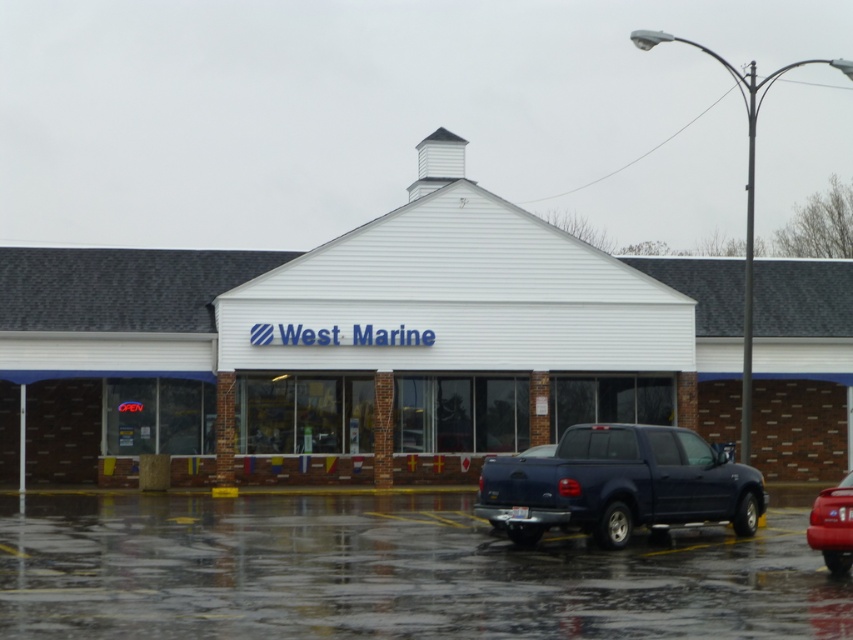
Measure the distance from wet asphalt at lower center to dark blue matte truck at lower center.

wet asphalt at lower center is 4.54 meters from dark blue matte truck at lower center.

This screenshot has height=640, width=853. What are the coordinates of `wet asphalt at lower center` in the screenshot? It's located at click(389, 573).

You are a GUI agent. You are given a task and a screenshot of the screen. Output one action in this format:
    pyautogui.click(x=<x>, y=<y>)
    Task: Click on the wet asphalt at lower center
    
    Given the screenshot: What is the action you would take?
    pyautogui.click(x=389, y=573)

Does dark blue matte truck at lower center have a larger size compared to shiny red car at lower right?

Incorrect, dark blue matte truck at lower center is not larger than shiny red car at lower right.

Does point (613, 452) lie behind point (810, 540)?

Yes, point (613, 452) is behind point (810, 540).

Find the location of a particular element. dark blue matte truck at lower center is located at coordinates (618, 484).

Between wet asphalt at lower center and shiny red car at lower right, which one has more height?

Standing taller between the two is shiny red car at lower right.

Between wet asphalt at lower center and shiny red car at lower right, which one is positioned higher?

wet asphalt at lower center is above.

You are a GUI agent. You are given a task and a screenshot of the screen. Output one action in this format:
    pyautogui.click(x=<x>, y=<y>)
    Task: Click on the wet asphalt at lower center
    Image resolution: width=853 pixels, height=640 pixels.
    Given the screenshot: What is the action you would take?
    pyautogui.click(x=389, y=573)